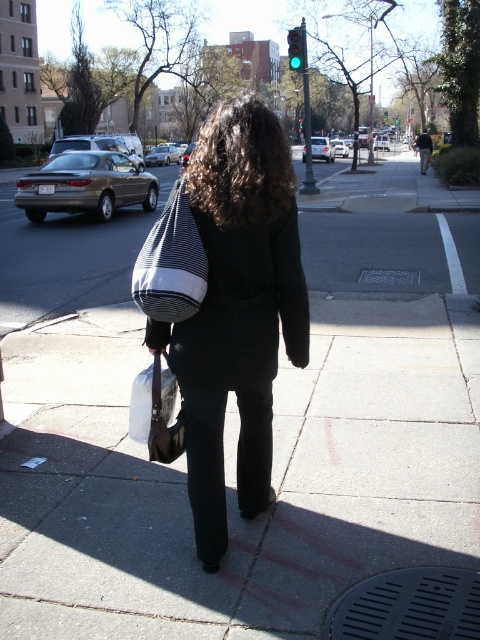
You are a delivery person who needs to deliver a package to the person walking away. The package must be placed precisely at the coordinates mentioned in the scene description. Where should you place the package relative to the black fabric bag at center?

The package should be placed at the coordinates mentioned in the Objects Description, which is point (237, 308), the same location as the black fabric bag at center.

You are a photographer trying to capture the perfect shot of the person walking away. You notice two points in the image at coordinates point (252,284) and point (291,38). Which point is closer to your camera lens?

Point (252,284) is closer to the camera than point (291,38).